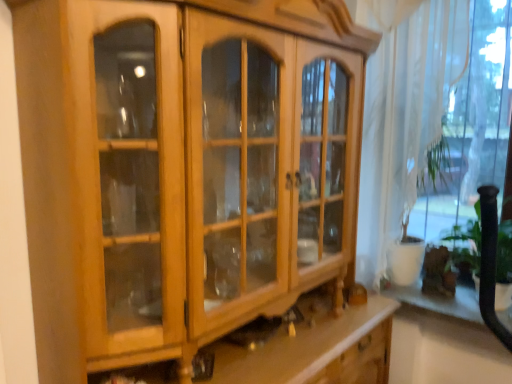
Where is `white glossy shelf at lower right`? This screenshot has height=384, width=512. white glossy shelf at lower right is located at coordinates (438, 300).

Measure the distance between white glossy shelf at lower right and camera.

white glossy shelf at lower right is 1.94 meters away from camera.

What do you see at coordinates (438, 300) in the screenshot? The height and width of the screenshot is (384, 512). I see `white glossy shelf at lower right` at bounding box center [438, 300].

Find the location of `white sheer curtain at right`. white sheer curtain at right is located at coordinates (432, 124).

Describe the element at coordinates (432, 124) in the screenshot. The image size is (512, 384). I see `white sheer curtain at right` at that location.

Based on the photo, what is the approximate height of white sheer curtain at right?

white sheer curtain at right is 4.47 feet tall.

Where is `white glossy shelf at lower right`? white glossy shelf at lower right is located at coordinates (438, 300).

In the image, is white glossy shelf at lower right on the left side or the right side of white sheer curtain at right?

white glossy shelf at lower right is to the right of white sheer curtain at right.

Is white glossy shelf at lower right further to camera compared to white sheer curtain at right?

Yes, the depth of white glossy shelf at lower right is greater than that of white sheer curtain at right.

Which is behind, point (463, 305) or point (495, 136)?

The point (495, 136) is farther.

From the image's perspective, is white glossy shelf at lower right positioned above or below white sheer curtain at right?

Based on their image positions, white glossy shelf at lower right is located beneath white sheer curtain at right.

From a real-world perspective, who is located higher, white glossy shelf at lower right or white sheer curtain at right?

In real-world perspective, white sheer curtain at right is above.

Looking at their sizes, would you say white glossy shelf at lower right is wider or thinner than white sheer curtain at right?

Considering their sizes, white glossy shelf at lower right looks broader than white sheer curtain at right.

Who is taller, white glossy shelf at lower right or white sheer curtain at right?

white sheer curtain at right is taller.

Consider the image. Which of these two, white glossy shelf at lower right or white sheer curtain at right, is bigger?

white sheer curtain at right is bigger.

Would you say white glossy shelf at lower right is inside or outside white sheer curtain at right?

white glossy shelf at lower right is not enclosed by white sheer curtain at right.

Does white glossy shelf at lower right touch white sheer curtain at right?

No, white glossy shelf at lower right is not beside white sheer curtain at right.

Is white glossy shelf at lower right oriented away from white sheer curtain at right?

white glossy shelf at lower right is not turned away from white sheer curtain at right.

How many degrees apart are the facing directions of white glossy shelf at lower right and white sheer curtain at right?

white glossy shelf at lower right and white sheer curtain at right are facing 0.89 degrees away from each other.

This screenshot has height=384, width=512. What are the coordinates of `window in front of the white glossy shelf at lower right` in the screenshot? It's located at (432, 124).

Which is more to the left, white sheer curtain at right or white glossy shelf at lower right?

white sheer curtain at right.

Considering the positions of objects white sheer curtain at right and white glossy shelf at lower right in the image provided, who is in front, white sheer curtain at right or white glossy shelf at lower right?

white sheer curtain at right is in front.

Which is nearer, (408,61) or (424,305)?

The point (408,61) is closer.

From the image's perspective, is white sheer curtain at right on white glossy shelf at lower right?

Indeed, from the image's perspective, white sheer curtain at right is shown above white glossy shelf at lower right.

From a real-world perspective, is white sheer curtain at right located beneath white glossy shelf at lower right?

No, from a real-world perspective, white sheer curtain at right is not beneath white glossy shelf at lower right.

Between white sheer curtain at right and white glossy shelf at lower right, which one has smaller width?

white sheer curtain at right is thinner.

Is white sheer curtain at right shorter than white glossy shelf at lower right?

Incorrect, the height of white sheer curtain at right does not fall short of that of white glossy shelf at lower right.

Between white sheer curtain at right and white glossy shelf at lower right, which one has larger size?

white sheer curtain at right is bigger.

Based on the photo, is white sheer curtain at right completely or partially outside of white glossy shelf at lower right?

white sheer curtain at right is positioned outside white glossy shelf at lower right.

Are white sheer curtain at right and white glossy shelf at lower right far apart?

white sheer curtain at right is actually quite close to white glossy shelf at lower right.

In the scene shown: Does white sheer curtain at right turn towards white glossy shelf at lower right?

No, white sheer curtain at right does not turn towards white glossy shelf at lower right.

How many degrees apart are the facing directions of white sheer curtain at right and white glossy shelf at lower right?

0.89 degrees separate the facing orientations of white sheer curtain at right and white glossy shelf at lower right.

This screenshot has height=384, width=512. I want to click on shelf that appears on the right of white sheer curtain at right, so click(x=438, y=300).

Where is `window above the white glossy shelf at lower right (from the image's perspective)`? Image resolution: width=512 pixels, height=384 pixels. window above the white glossy shelf at lower right (from the image's perspective) is located at coordinates (432, 124).

You are a GUI agent. You are given a task and a screenshot of the screen. Output one action in this format:
    pyautogui.click(x=<x>, y=<y>)
    Task: Click on the window that appears in front of the white glossy shelf at lower right
    
    Given the screenshot: What is the action you would take?
    pyautogui.click(x=432, y=124)